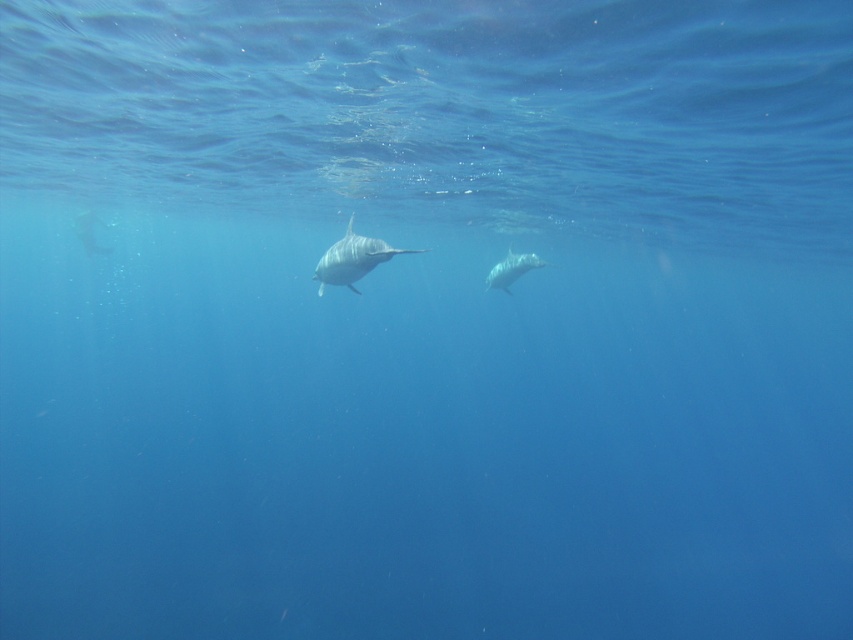
You are a marine biologist observing an underwater scene with two dolphins. You notice a point at coordinates (352, 259). Which dolphin is this point marking?

The point at coordinates (352, 259) marks the smooth gray dolphin at center.

Looking at this image, you are a marine biologist observing the underwater scene. You notice two dolphins swimming centrally. Which dolphin, the smooth gray dolphin at center or the white smooth dolphin at center, has a shorter height?

The smooth gray dolphin at center is not as tall as the white smooth dolphin at center, so the smooth gray dolphin at center has a shorter height.

You are a diver who wants to reach the point marked at coordinates point (387, 256) in the underwater scene. Given that your diving gear allows you to swim at a maximum depth of 25 feet, can you safely reach that point?

The distance between you and point (387, 256) is 24.10 feet, which is within your diving gear limit of 25 feet. Therefore, you can safely reach the point.